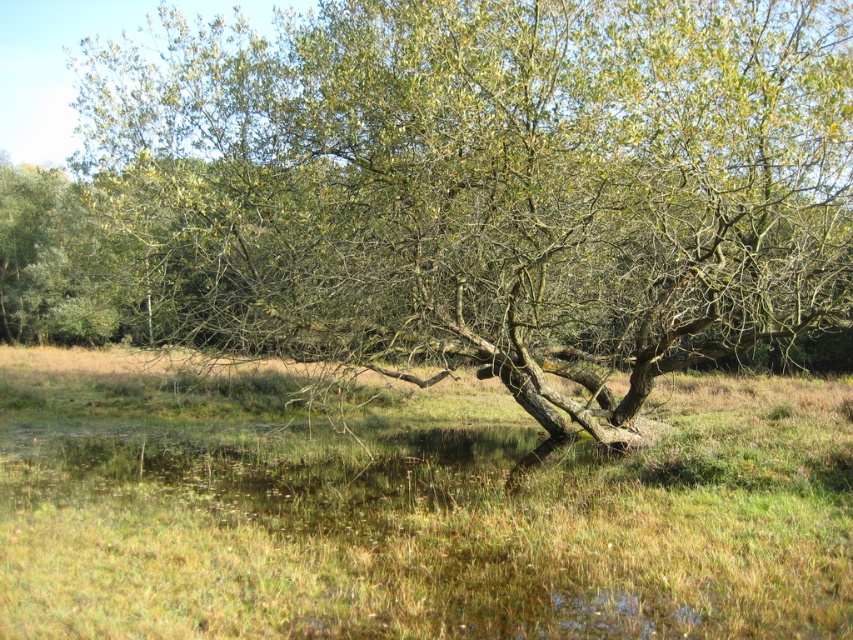
Question: Does green leafy tree at center appear on the left side of green grass at center?

Choices:
 (A) yes
 (B) no

Answer: (A)

Question: Considering the relative positions of green leafy tree at center and green grass at center in the image provided, where is green leafy tree at center located with respect to green grass at center?

Choices:
 (A) below
 (B) above

Answer: (B)

Question: Which object is closer to the camera taking this photo?

Choices:
 (A) green leafy tree at center
 (B) green grass at center

Answer: (B)

Question: Which point is closer to the camera?

Choices:
 (A) (181, 474)
 (B) (738, 205)

Answer: (B)

Question: Can you confirm if green leafy tree at center is bigger than green grass at center?

Choices:
 (A) no
 (B) yes

Answer: (B)